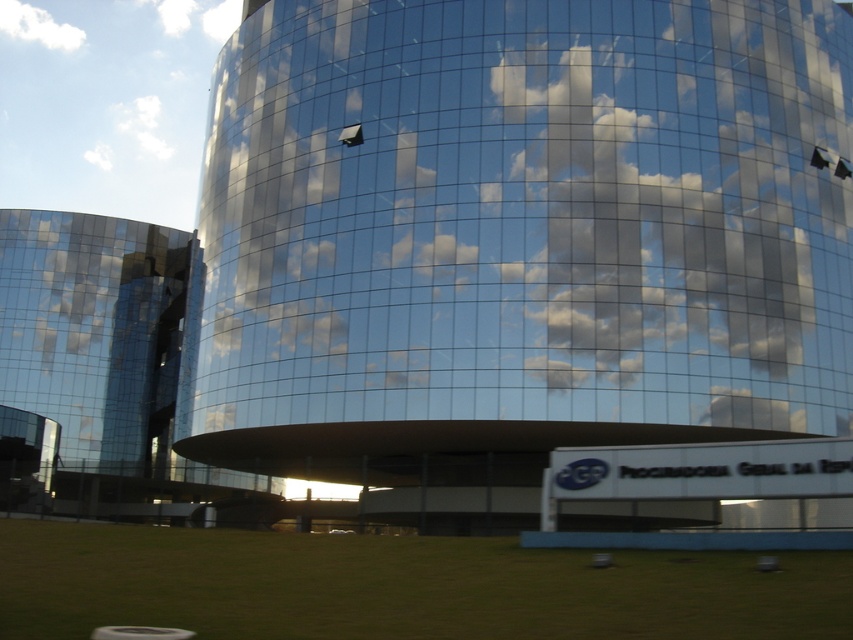
You are standing in front of the modern glass building and see two points marked on the ground. The first point is at coordinates point [459,298] and the second is at point [7,22]. Which point is closer to you?

Point [459,298] is in front of point [7,22], so it is closer to you.

You are standing in front of the modern glass building and see the point at coordinates (x=529, y=214). What is the position of this point relative to the transparent glass cloud at center?

The point at coordinates (x=529, y=214) is located on the transparent glass cloud at center.